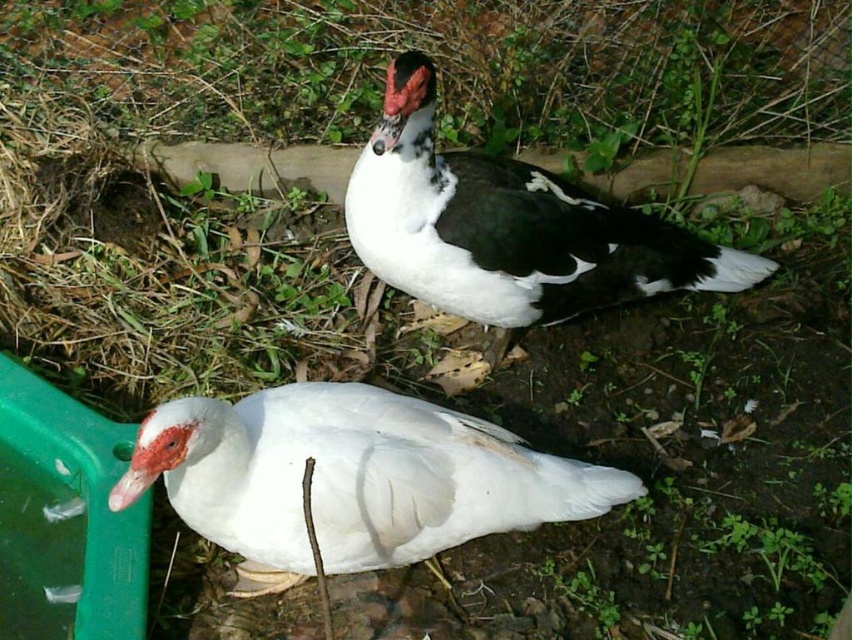
From the picture: Does white matte duck at lower left appear under white matte duck at center?

Yes.

Measure the distance from white matte duck at lower left to white matte duck at center.

20.22 inches

Between point (383, 490) and point (350, 237), which one is positioned in front?

Positioned in front is point (383, 490).

Where is `white matte duck at lower left`? white matte duck at lower left is located at coordinates (350, 477).